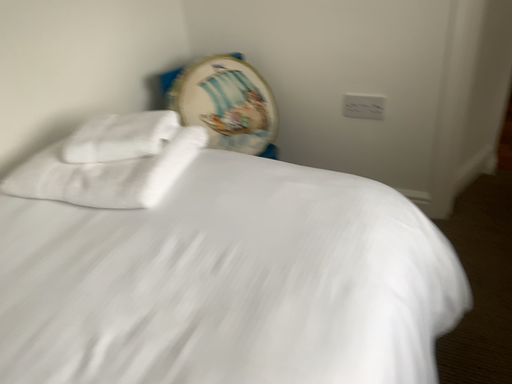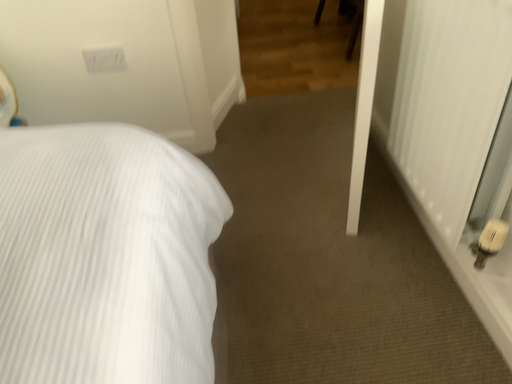
Question: How did the camera likely rotate when shooting the video?

Choices:
 (A) rotated right
 (B) rotated left

Answer: (A)